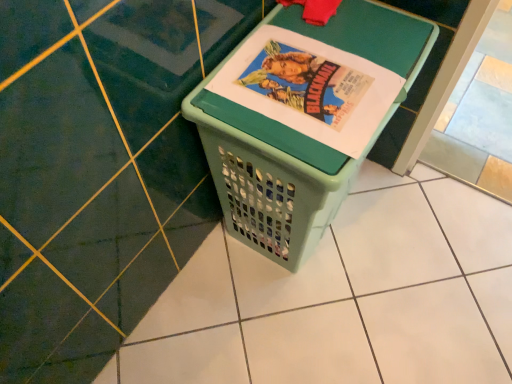
Locate an element on the screen. The image size is (512, 384). free space in front of green plastic laundry basket at center is located at coordinates (300, 325).